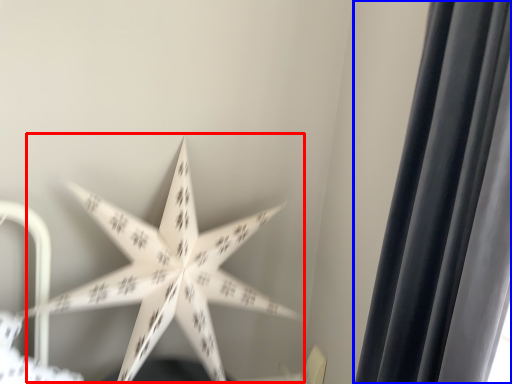
Question: Which point is closer to the camera, star (highlighted by a red box) or curtain (highlighted by a blue box)?

Choices:
 (A) star
 (B) curtain

Answer: (B)